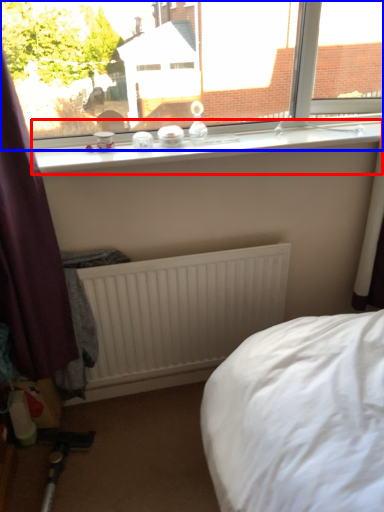
Question: Among these objects, which one is nearest to the camera, window sill (highlighted by a red box) or window (highlighted by a blue box)?

Choices:
 (A) window sill
 (B) window

Answer: (B)